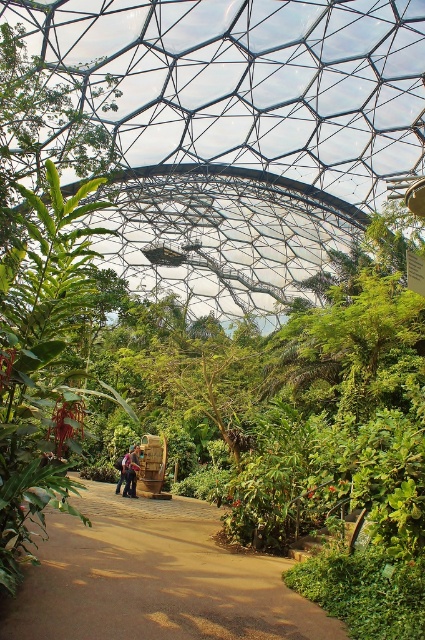
Question: Considering the real-world distances, which object is closest to the dark blue jeans at center?

Choices:
 (A) brown dirt path at center
 (B) denim jacket at center

Answer: (B)

Question: Is brown dirt path at center in front of denim jacket at center?

Choices:
 (A) no
 (B) yes

Answer: (B)

Question: Does brown dirt path at center have a smaller size compared to denim jacket at center?

Choices:
 (A) no
 (B) yes

Answer: (A)

Question: Which of these objects is positioned closest to the dark blue jeans at center?

Choices:
 (A) brown dirt path at center
 (B) denim jacket at center

Answer: (B)

Question: Does brown dirt path at center come behind dark blue jeans at center?

Choices:
 (A) yes
 (B) no

Answer: (B)

Question: Which of the following is the farthest from the observer?

Choices:
 (A) (141, 500)
 (B) (129, 465)
 (C) (135, 497)

Answer: (B)